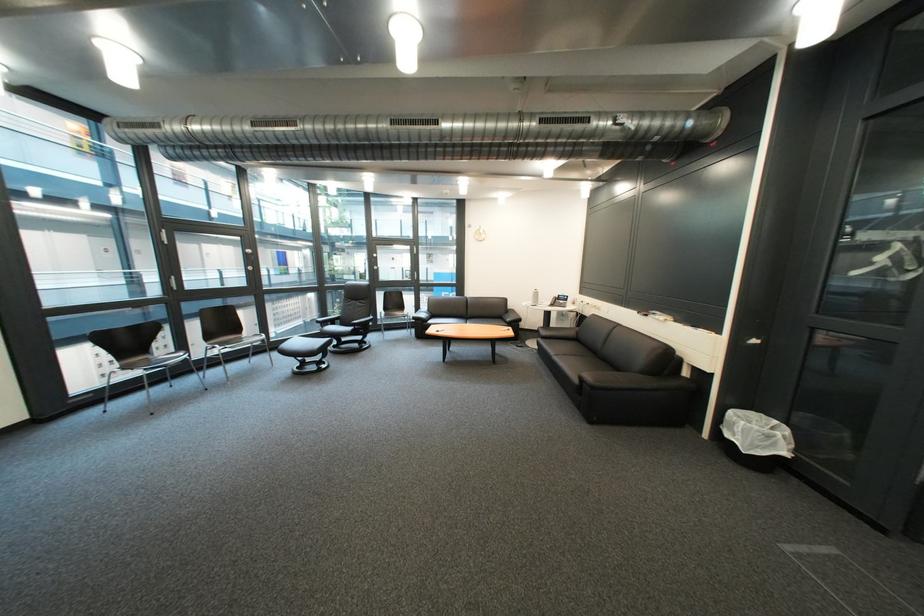
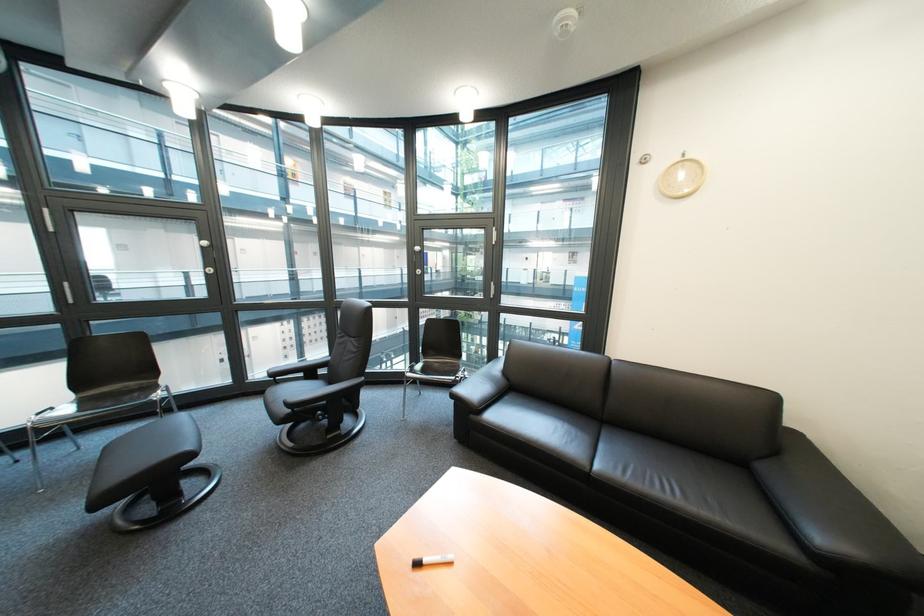
Locate, in the second image, the point that corresponds to point 521,322 in the first image.

(833, 540)